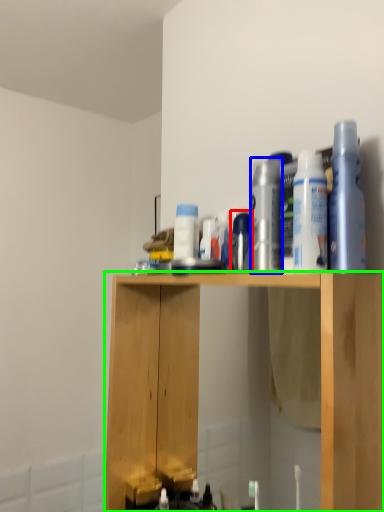
Question: Estimate the real-world distances between objects in this image. Which object is farther from toiletry (highlighted by a red box), cleaning product (highlighted by a blue box) or cabinetry (highlighted by a green box)?

Choices:
 (A) cleaning product
 (B) cabinetry

Answer: (B)